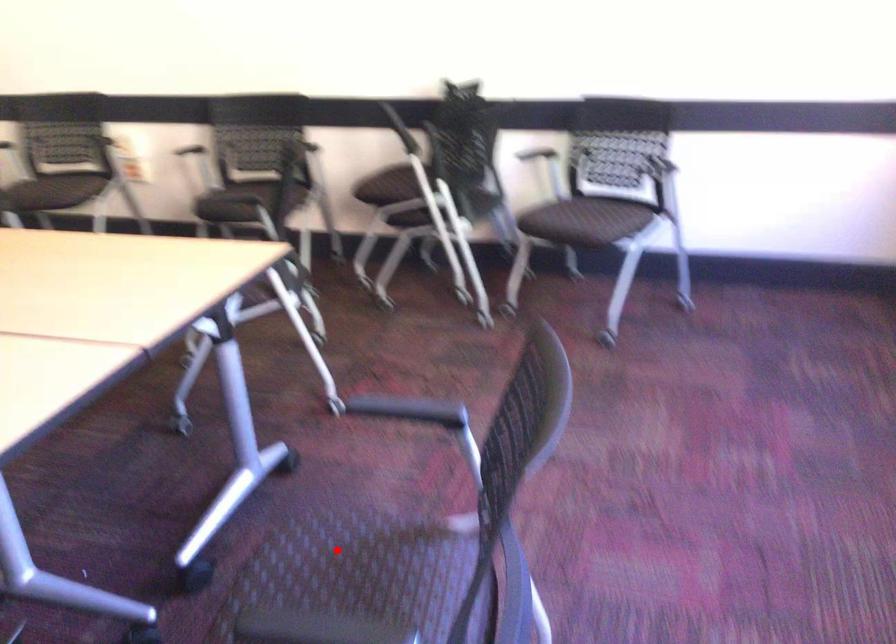
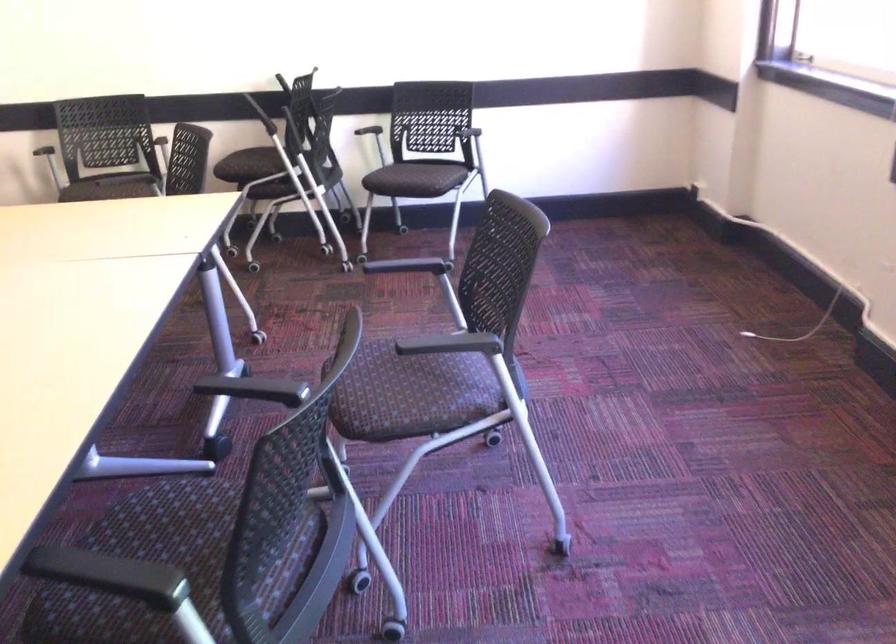
Locate, in the second image, the point that corresponds to the highlighted location in the first image.

(375, 366)